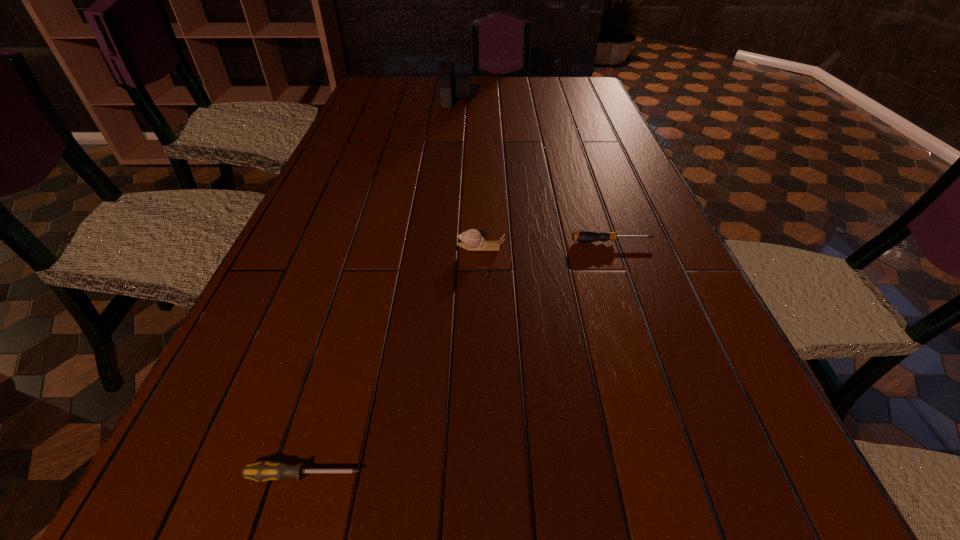
What are the coordinates of `free area in between the rightmost object and the escargot` in the screenshot? It's located at (546, 245).

Where is `free spot between the nearer screwdriver and the farther screwdriver`? The width and height of the screenshot is (960, 540). free spot between the nearer screwdriver and the farther screwdriver is located at coordinates (458, 359).

Where is `empty space that is in between the tallest object and the right screwdriver`? This screenshot has width=960, height=540. empty space that is in between the tallest object and the right screwdriver is located at coordinates (534, 171).

You are a GUI agent. You are given a task and a screenshot of the screen. Output one action in this format:
    pyautogui.click(x=<x>, y=<y>)
    Task: Click on the vacant space that is in between the nearest object and the farther screwdriver
    
    Given the screenshot: What is the action you would take?
    pyautogui.click(x=458, y=359)

Image resolution: width=960 pixels, height=540 pixels. Find the location of `unoccupied area between the escargot and the camera`. unoccupied area between the escargot and the camera is located at coordinates (468, 174).

You are a GUI agent. You are given a task and a screenshot of the screen. Output one action in this format:
    pyautogui.click(x=<x>, y=<y>)
    Task: Click on the free area in between the farthest object and the second tallest object
    The image size is (960, 540).
    Given the screenshot: What is the action you would take?
    pyautogui.click(x=468, y=174)

You are a GUI agent. You are given a task and a screenshot of the screen. Output one action in this format:
    pyautogui.click(x=<x>, y=<y>)
    Task: Click on the free spot between the farthest object and the escargot
    Image resolution: width=960 pixels, height=540 pixels.
    Given the screenshot: What is the action you would take?
    pyautogui.click(x=468, y=174)

Locate an element on the screen. vacant region between the camera and the escargot is located at coordinates (468, 174).

Where is `free space between the nearer screwdriver and the rightmost object`? free space between the nearer screwdriver and the rightmost object is located at coordinates (458, 359).

Image resolution: width=960 pixels, height=540 pixels. I want to click on free space between the rightmost object and the third shortest object, so click(546, 245).